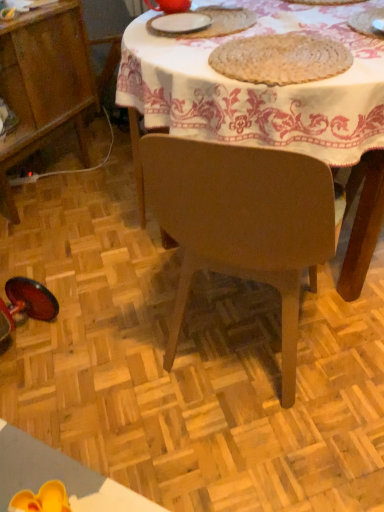
This screenshot has width=384, height=512. I want to click on vacant space to the left of matte red teapot at upper center, arranged as the 1th tableware when viewed from the left, so click(x=142, y=20).